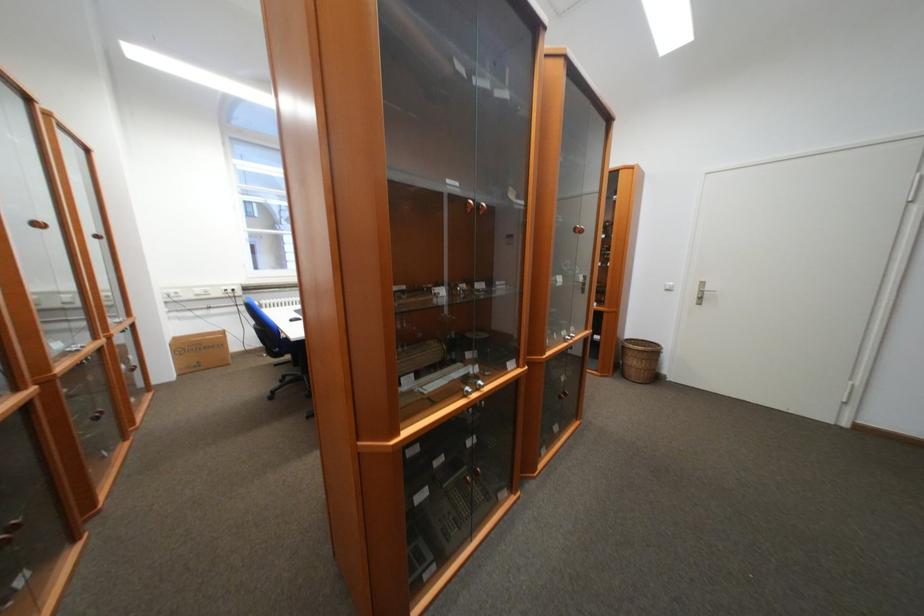
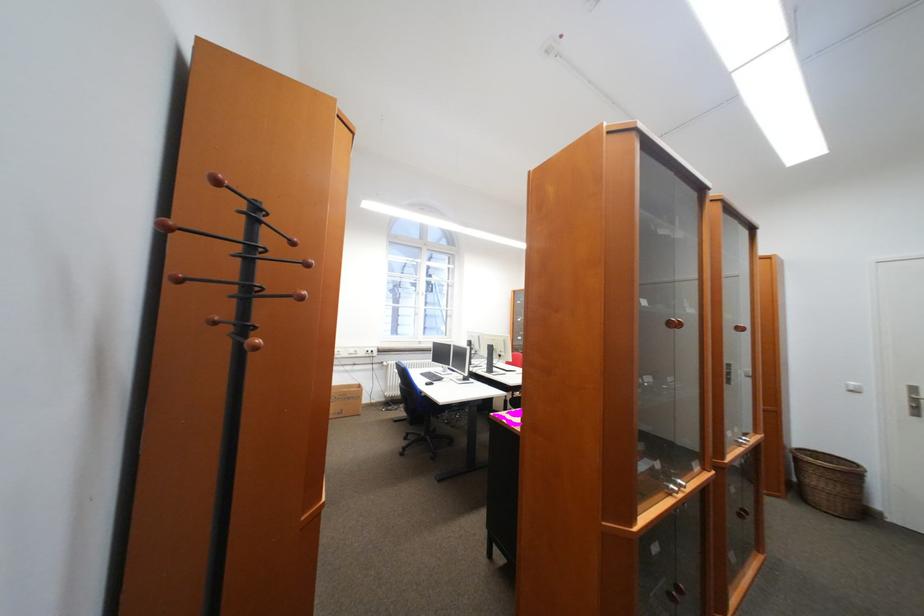
Locate, in the second image, the point that corresponds to (x=472, y=390) in the first image.

(676, 487)